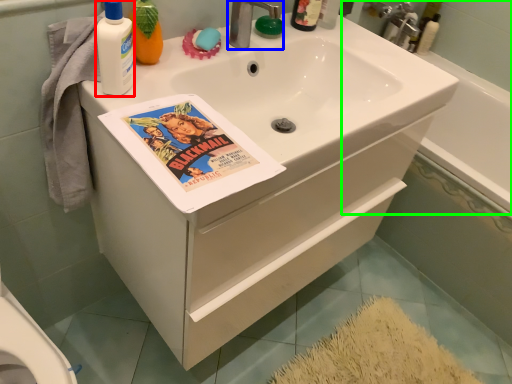
Question: Estimate the real-world distances between objects in this image. Which object is farther from cleaning product (highlighted by a red box), tap (highlighted by a blue box) or bath (highlighted by a green box)?

Choices:
 (A) tap
 (B) bath

Answer: (B)